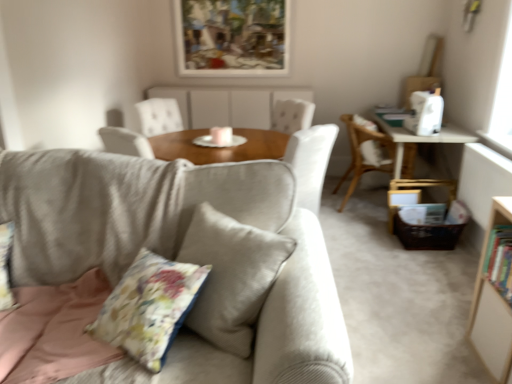
Question: From a real-world perspective, is white wood bookcase at right below light gray fabric couch at center?

Choices:
 (A) yes
 (B) no

Answer: (A)

Question: Is white wood bookcase at right far from light gray fabric couch at center?

Choices:
 (A) no
 (B) yes

Answer: (B)

Question: Is white wood bookcase at right taller than light gray fabric couch at center?

Choices:
 (A) yes
 (B) no

Answer: (B)

Question: Is white wood bookcase at right to the right of light gray fabric couch at center from the viewer's perspective?

Choices:
 (A) no
 (B) yes

Answer: (B)

Question: Can you confirm if white wood bookcase at right is bigger than light gray fabric couch at center?

Choices:
 (A) yes
 (B) no

Answer: (B)

Question: From a real-world perspective, is matte wood table at center physically located above or below floral fabric pillow at center?

Choices:
 (A) above
 (B) below

Answer: (A)

Question: Considering the positions of matte wood table at center and floral fabric pillow at center in the image, is matte wood table at center bigger or smaller than floral fabric pillow at center?

Choices:
 (A) big
 (B) small

Answer: (A)

Question: Which is correct: matte wood table at center is inside floral fabric pillow at center, or outside of it?

Choices:
 (A) outside
 (B) inside

Answer: (A)

Question: Considering their positions, is matte wood table at center located in front of or behind floral fabric pillow at center?

Choices:
 (A) behind
 (B) front

Answer: (A)

Question: From a real-world perspective, is white wood bookcase at right physically located above or below wooden table at right?

Choices:
 (A) above
 (B) below

Answer: (A)

Question: Considering the positions of white wood bookcase at right and wooden table at right in the image, is white wood bookcase at right taller or shorter than wooden table at right?

Choices:
 (A) tall
 (B) short

Answer: (A)

Question: Relative to wooden table at right, is white wood bookcase at right in front or behind?

Choices:
 (A) front
 (B) behind

Answer: (A)

Question: Considering the positions of point (481, 264) and point (419, 140), is point (481, 264) closer or farther from the camera than point (419, 140)?

Choices:
 (A) closer
 (B) farther

Answer: (A)

Question: Relative to matte wood table at center, is white wood bookcase at right in front or behind?

Choices:
 (A) behind
 (B) front

Answer: (B)

Question: From the image's perspective, is white wood bookcase at right above or below matte wood table at center?

Choices:
 (A) below
 (B) above

Answer: (A)